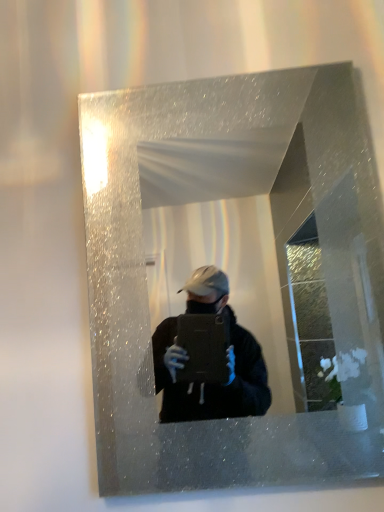
This screenshot has height=512, width=384. What do you see at coordinates (236, 279) in the screenshot?
I see `cracked glass mirror at center` at bounding box center [236, 279].

Measure the distance between point [181,194] and camera.

Point [181,194] is 2.82 meters from camera.

The image size is (384, 512). I want to click on cracked glass mirror at center, so click(x=236, y=279).

Identify the location of cracked glass mirror at center. (236, 279).